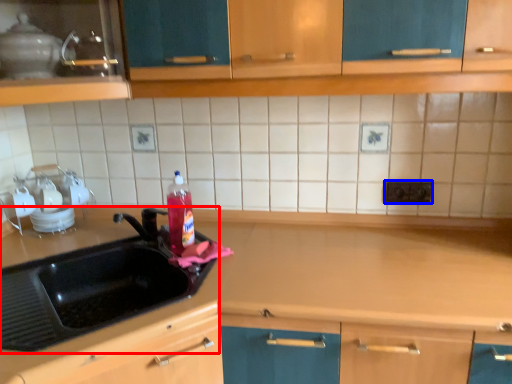
Question: Which object is closer to the camera taking this photo, sink (highlighted by a red box) or electric outlet (highlighted by a blue box)?

Choices:
 (A) sink
 (B) electric outlet

Answer: (A)